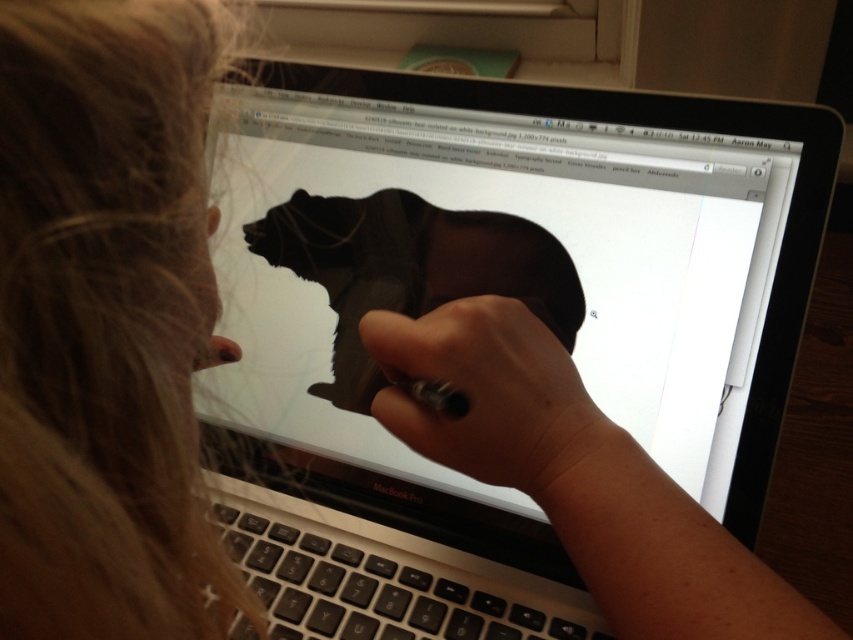
Between point (415, 228) and point (453, 364), which one is positioned behind?

The point (415, 228) is behind.

Is point (259, 248) closer to camera compared to point (525, 344)?

That is False.

The image size is (853, 640). I want to click on shiny black bear at center, so click(410, 269).

Consider the image. Can you confirm if blonde hair at upper left is bigger than black matte pen at center?

Yes.

In the scene shown: Who is shorter, blonde hair at upper left or black matte pen at center?

black matte pen at center

Is point (169, 148) farther from camera compared to point (509, 380)?

No, (169, 148) is in front of (509, 380).

Identify the location of blonde hair at upper left. The image size is (853, 640). (106, 321).

Is point (126, 388) closer to viewer compared to point (386, 216)?

Yes, point (126, 388) is closer to viewer.

Locate an element on the screen. blonde hair at upper left is located at coordinates (106, 321).